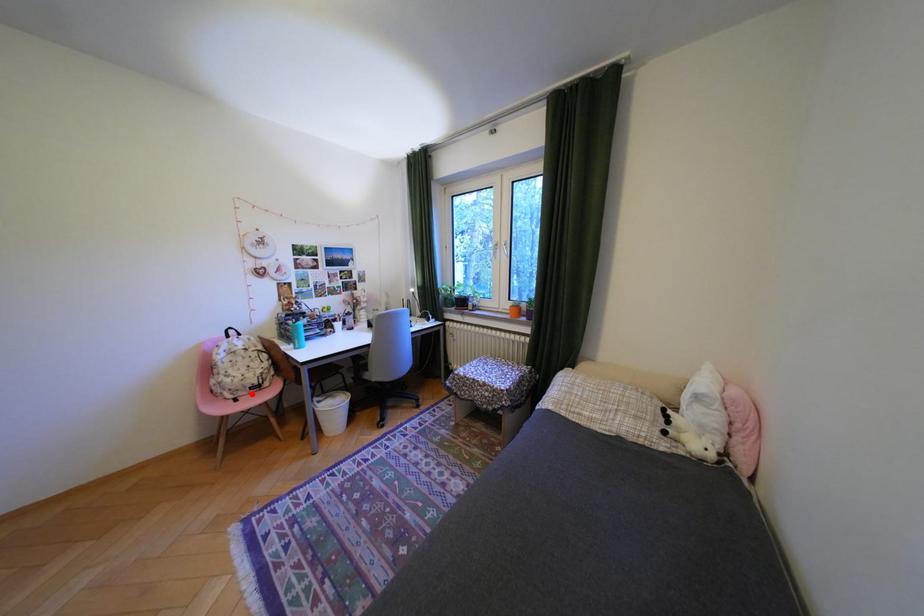
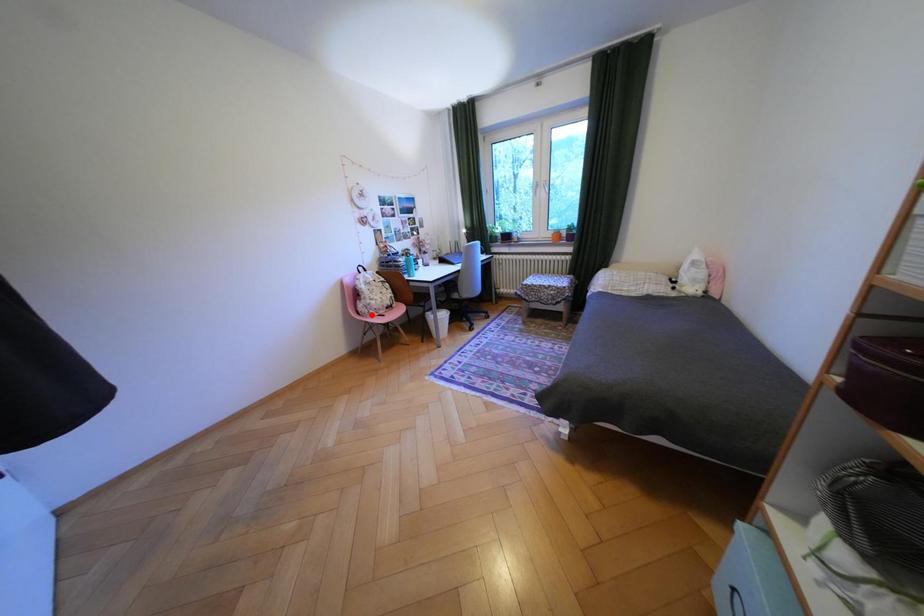
I am providing you with two images of the same scene from different viewpoints. A red point is marked on the first image and another point is marked on the second image. Does the point marked in image1 correspond to the same location as the one in image2?

No